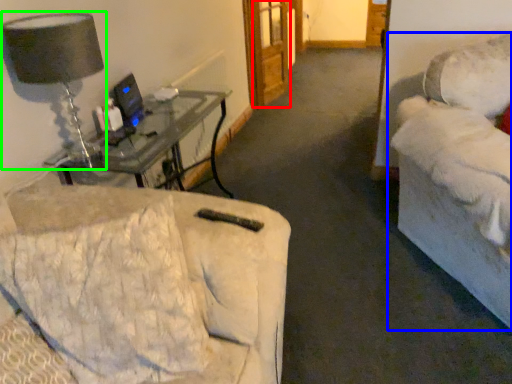
Question: Based on their relative distances, which object is nearer to glass door (highlighted by a red box)? Choose from studio couch (highlighted by a blue box) and table lamp (highlighted by a green box).

Choices:
 (A) studio couch
 (B) table lamp

Answer: (A)